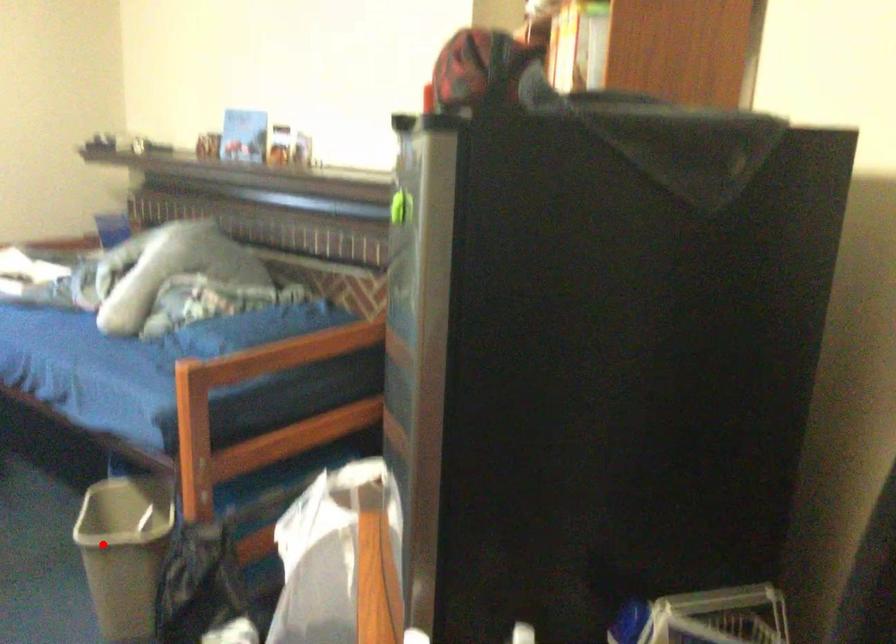
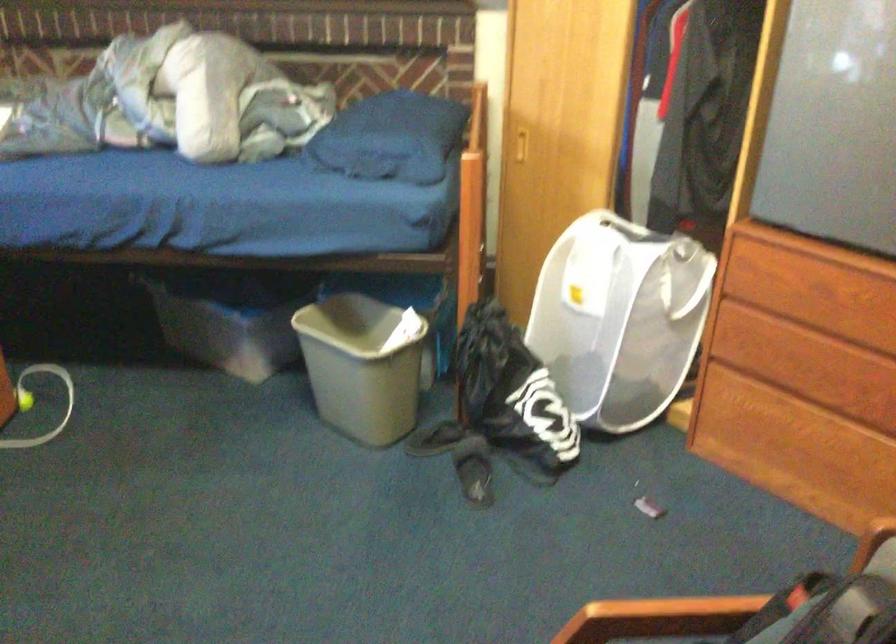
In the second image, find the point that corresponds to the highlighted location in the first image.

(363, 365)